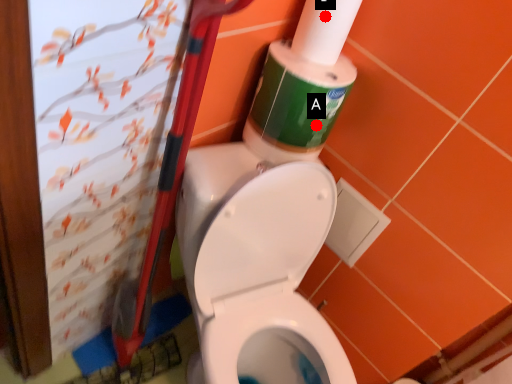
Question: Two points are circled on the image, labeled by A and B beside each circle. Which point is further to the camera?

Choices:
 (A) A is further
 (B) B is further

Answer: (A)